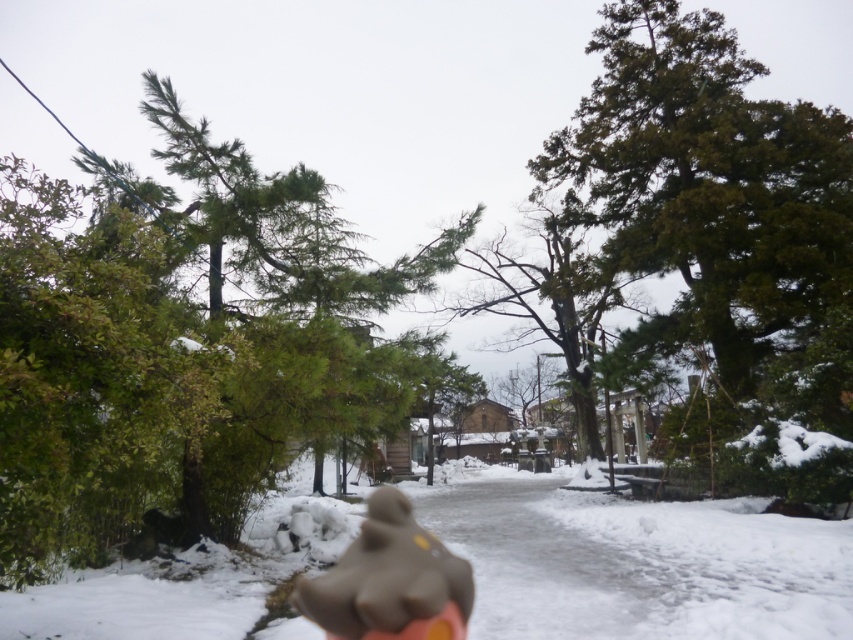
You are a photographer who wants to capture a closeup of the white fluffy snow at center. You are currently standing 4.09 meters away from the snow. Your camera has a zoom lens that can magnify objects up to 5x. What is the minimum distance you need to move closer to the snow to get a clear closeup without using the zoom?

Since the white fluffy snow at center and the camera are 4.09 meters apart, you need to move closer to reduce the distance. The minimum distance required for a clear closeup without zooming is typically around 1 meter. Therefore, you should move to within 1 meter of the snow.